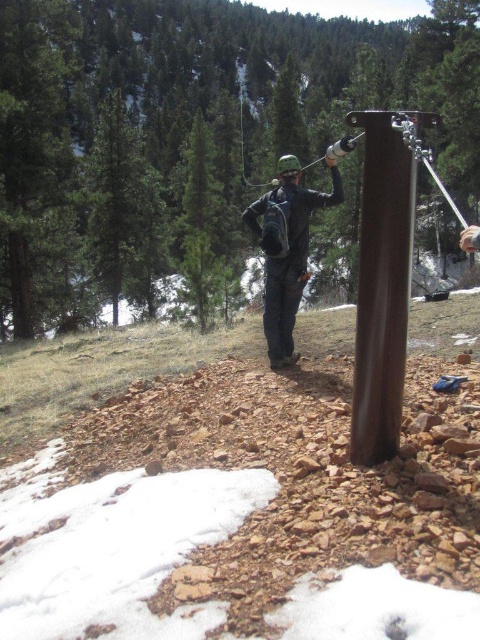
You are a hiker trying to navigate through the mountainous area. You see two points marked on your map at coordinates point [394,177] and point [291,259]. Which point is closer to your current position if you are standing at the base of the large dark brown cylindrical object?

Point [394,177] is in front of point [291,259], so if you are standing at the base of the large dark brown cylindrical object, point [394,177] would be closer to your current position.

You are a hiker trying to navigate through the rocky terrain. You see the brown metallic post at center and the metallic silver ski pole at upper center. Which object is taller?

The brown metallic post at center is smaller than the metallic silver ski pole at upper center, so the metallic silver ski pole at upper center is taller.